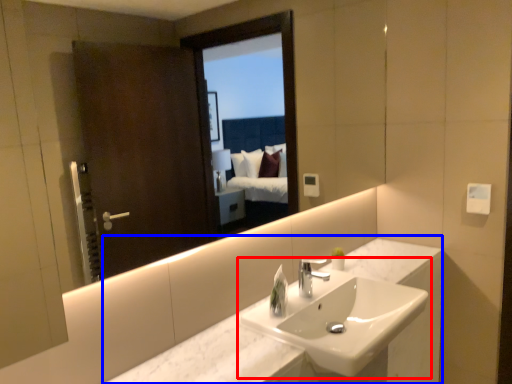
Question: Which object is closer to the camera taking this photo, sink (highlighted by a red box) or counter (highlighted by a blue box)?

Choices:
 (A) sink
 (B) counter

Answer: (B)